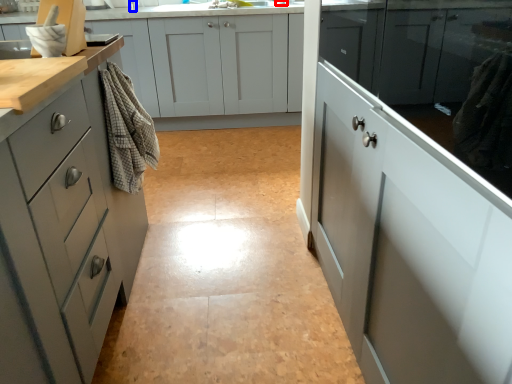
Question: Which object is further to the camera taking this photo, faucet (highlighted by a red box) or faucet (highlighted by a blue box)?

Choices:
 (A) faucet
 (B) faucet

Answer: (B)